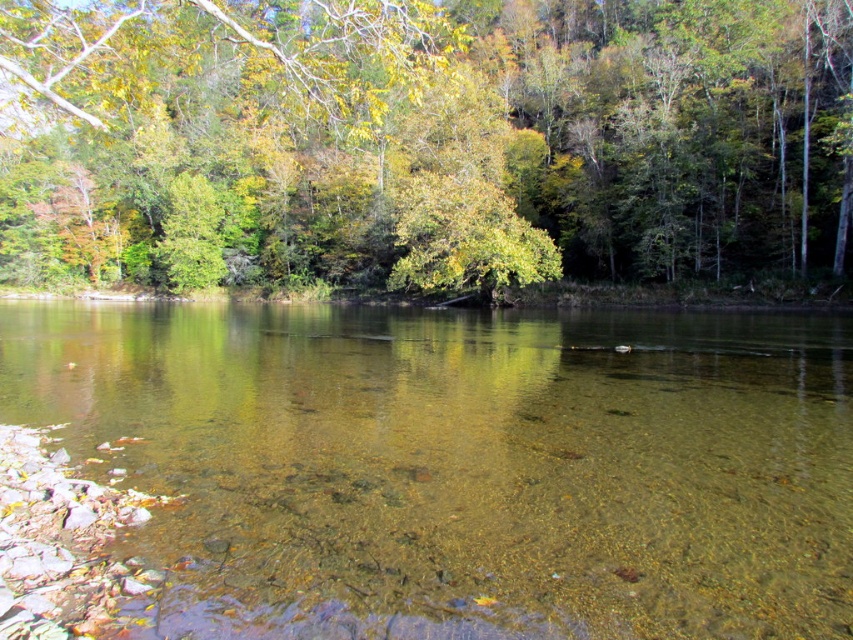
You are standing at the riverbank and looking at two points marked in the image. Which point, point (440, 625) or point (20, 179), is closer to your eyes?

Point (440, 625) is closer to the camera than point (20, 179), so it is closer to your eyes.

You are standing at the riverside and want to take a photo of the clear glass water at center and the green leafy tree at upper center. Which object will appear closer to the camera in the photo?

The clear glass water at center will appear closer to the camera in the photo because it is positioned in front of the green leafy tree at upper center.